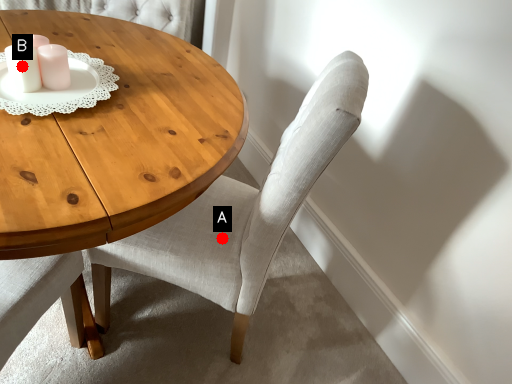
Question: Two points are circled on the image, labeled by A and B beside each circle. Which point is farther to the camera?

Choices:
 (A) A is further
 (B) B is further

Answer: (A)